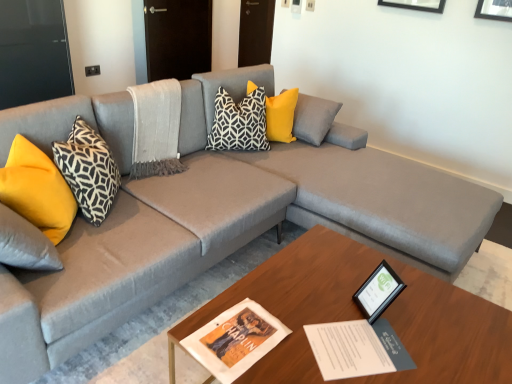
Image resolution: width=512 pixels, height=384 pixels. In order to click on white paper booklet at center in this screenshot , I will do `click(357, 349)`.

What are the coordinates of `the 3rd pillow located above the wooden coffee table at center (from a real-world perspective)` in the screenshot? It's located at (x=281, y=116).

Which is more to the right, yellow fabric pillow at center, the 4th pillow viewed from the left, or wooden coffee table at center?

From the viewer's perspective, wooden coffee table at center appears more on the right side.

From the image's perspective, is yellow fabric pillow at center, placed as the first pillow when sorted from right to left, positioned above or below wooden coffee table at center?

From the image's perspective, yellow fabric pillow at center, placed as the first pillow when sorted from right to left, appears above wooden coffee table at center.

Is yellow fabric pillow at center, the 4th pillow viewed from the left, next to wooden coffee table at center and touching it?

No, yellow fabric pillow at center, the 4th pillow viewed from the left, is not next to wooden coffee table at center.

From a real-world perspective, between yellow fabric pillow at left, placed as the 4th pillow when sorted from right to left, and white paper booklet at center, who is vertically higher?

yellow fabric pillow at left, placed as the 4th pillow when sorted from right to left, is physically above.

Which of these two, yellow fabric pillow at left, placed as the 4th pillow when sorted from right to left, or white paper booklet at center, is wider?

yellow fabric pillow at left, placed as the 4th pillow when sorted from right to left, is wider.

Is yellow fabric pillow at left, which ranks as the first pillow in left-to-right order, next to white paper booklet at center and touching it?

No, yellow fabric pillow at left, which ranks as the first pillow in left-to-right order, is not next to white paper booklet at center.

Does point (10, 172) come behind point (396, 345)?

Yes, it is behind point (396, 345).

Is wooden coffee table at center at the back of yellow fabric pillow at left, which ranks as the first pillow in left-to-right order?

No.

Who is more distant, yellow fabric pillow at left, which ranks as the first pillow in left-to-right order, or wooden coffee table at center?

yellow fabric pillow at left, which ranks as the first pillow in left-to-right order, is more distant.

Which is nearer, (x=36, y=221) or (x=420, y=276)?

The point (x=36, y=221) is more forward.

Does yellow fabric pillow at left, placed as the 4th pillow when sorted from right to left, appear on the right side of wooden coffee table at center?

Incorrect, yellow fabric pillow at left, placed as the 4th pillow when sorted from right to left, is not on the right side of wooden coffee table at center.

Is yellow fabric pillow at left, placed as the 4th pillow when sorted from right to left, taller than black glossy picture frame at lower right?

Correct, yellow fabric pillow at left, placed as the 4th pillow when sorted from right to left, is much taller as black glossy picture frame at lower right.

In the scene shown: From a real-world perspective, is yellow fabric pillow at left, which ranks as the first pillow in left-to-right order, beneath black glossy picture frame at lower right?

Incorrect, from a real-world perspective, yellow fabric pillow at left, which ranks as the first pillow in left-to-right order, is higher than black glossy picture frame at lower right.

Does point (15, 196) come in front of point (360, 304)?

That is False.

Would you consider wooden coffee table at center to be distant from black glossy picture frame at lower right?

Actually, wooden coffee table at center and black glossy picture frame at lower right are a little close together.

Is wooden coffee table at center to the left or to the right of black glossy picture frame at lower right in the image?

Clearly, wooden coffee table at center is on the left of black glossy picture frame at lower right in the image.

Between wooden coffee table at center and black glossy picture frame at lower right, which one has larger size?

With larger size is wooden coffee table at center.

Is point (313, 247) closer or farther from the camera than point (365, 308)?

Point (313, 247) is farther from the camera than point (365, 308).

Considering the positions of objects wooden coffee table at center and white paper booklet at center in the image provided, who is more to the left, wooden coffee table at center or white paper booklet at center?

white paper booklet at center.

Is wooden coffee table at center surrounding white paper booklet at center?

Yes, wooden coffee table at center contains white paper booklet at center.

Which object is wider, wooden coffee table at center or white paper booklet at center?

wooden coffee table at center is wider.

Would you consider wooden coffee table at center to be distant from white paper booklet at center?

They are positioned close to each other.

Image resolution: width=512 pixels, height=384 pixels. In order to click on picture frame lying below the yellow fabric pillow at left, placed as the 4th pillow when sorted from right to left (from the image's perspective) in this screenshot , I will do `click(378, 292)`.

Who is bigger, black glossy picture frame at lower right or yellow fabric pillow at left, which ranks as the first pillow in left-to-right order?

yellow fabric pillow at left, which ranks as the first pillow in left-to-right order.

Is the surface of black glossy picture frame at lower right in direct contact with yellow fabric pillow at left, which ranks as the first pillow in left-to-right order?

black glossy picture frame at lower right is not next to yellow fabric pillow at left, which ranks as the first pillow in left-to-right order, and they're not touching.

Considering the sizes of black glossy picture frame at lower right and yellow fabric pillow at left, which ranks as the first pillow in left-to-right order, in the image, is black glossy picture frame at lower right taller or shorter than yellow fabric pillow at left, which ranks as the first pillow in left-to-right order,?

black glossy picture frame at lower right is shorter than yellow fabric pillow at left, which ranks as the first pillow in left-to-right order.

Image resolution: width=512 pixels, height=384 pixels. I want to click on the 1st pillow to the left of the wooden coffee table at center, counting from the anchor's position, so click(281, 116).

I want to click on book directly beneath the yellow fabric pillow at left, placed as the 4th pillow when sorted from right to left (from a real-world perspective), so click(357, 349).

Based on their spatial positions, is white paper booklet at center or black and white geometric pillow at left, marked as the third pillow in a right-to-left arrangement, closer to yellow fabric pillow at left, placed as the 4th pillow when sorted from right to left?

black and white geometric pillow at left, marked as the third pillow in a right-to-left arrangement.

From the image, which object appears to be farther from black and white geometric pillow at left, arranged as the 2th pillow when viewed from the left, yellow fabric pillow at center, the 4th pillow viewed from the left, or black and white geometric pillow at center, the second pillow viewed from the right?

yellow fabric pillow at center, the 4th pillow viewed from the left, is further to black and white geometric pillow at left, arranged as the 2th pillow when viewed from the left.

Based on their spatial positions, is wooden coffee table at center or black and white geometric pillow at left, marked as the third pillow in a right-to-left arrangement, closer to yellow fabric pillow at left, which ranks as the first pillow in left-to-right order?

black and white geometric pillow at left, marked as the third pillow in a right-to-left arrangement, lies closer to yellow fabric pillow at left, which ranks as the first pillow in left-to-right order, than the other object.

Looking at the image, which one is located closer to black glossy picture frame at lower right, black and white geometric pillow at center, positioned as the 3th pillow in left-to-right order, or yellow fabric pillow at left, placed as the 4th pillow when sorted from right to left?

yellow fabric pillow at left, placed as the 4th pillow when sorted from right to left, is positioned closer to the anchor black glossy picture frame at lower right.

Consider the image. Which object lies further to the anchor point yellow fabric pillow at left, placed as the 4th pillow when sorted from right to left, white paper booklet at center or black glossy picture frame at lower right?

black glossy picture frame at lower right.

Which object lies nearer to the anchor point yellow fabric pillow at center, placed as the first pillow when sorted from right to left, black glossy picture frame at lower right or wooden coffee table at center?

wooden coffee table at center is positioned closer to the anchor yellow fabric pillow at center, placed as the first pillow when sorted from right to left.

Considering their positions, is black and white geometric pillow at left, arranged as the 2th pillow when viewed from the left, positioned further to black and white geometric pillow at center, the second pillow viewed from the right, than black glossy picture frame at lower right?

black glossy picture frame at lower right.

Based on their spatial positions, is yellow fabric pillow at left, which ranks as the first pillow in left-to-right order, or yellow fabric pillow at center, the 4th pillow viewed from the left, closer to wooden coffee table at center?

yellow fabric pillow at left, which ranks as the first pillow in left-to-right order, is closer to wooden coffee table at center.

Where is `book located between black and white geometric pillow at left, marked as the third pillow in a right-to-left arrangement, and wooden coffee table at center in the left-right direction`? book located between black and white geometric pillow at left, marked as the third pillow in a right-to-left arrangement, and wooden coffee table at center in the left-right direction is located at coordinates (357, 349).

The image size is (512, 384). I want to click on book between black and white geometric pillow at left, marked as the third pillow in a right-to-left arrangement, and black glossy picture frame at lower right, in the horizontal direction, so click(357, 349).

The image size is (512, 384). In order to click on book situated between yellow fabric pillow at left, placed as the 4th pillow when sorted from right to left, and wooden coffee table at center from left to right in this screenshot , I will do `click(357, 349)`.

This screenshot has height=384, width=512. I want to click on picture frame positioned between white paper booklet at center and black and white geometric pillow at center, the second pillow viewed from the right, from near to far, so click(378, 292).